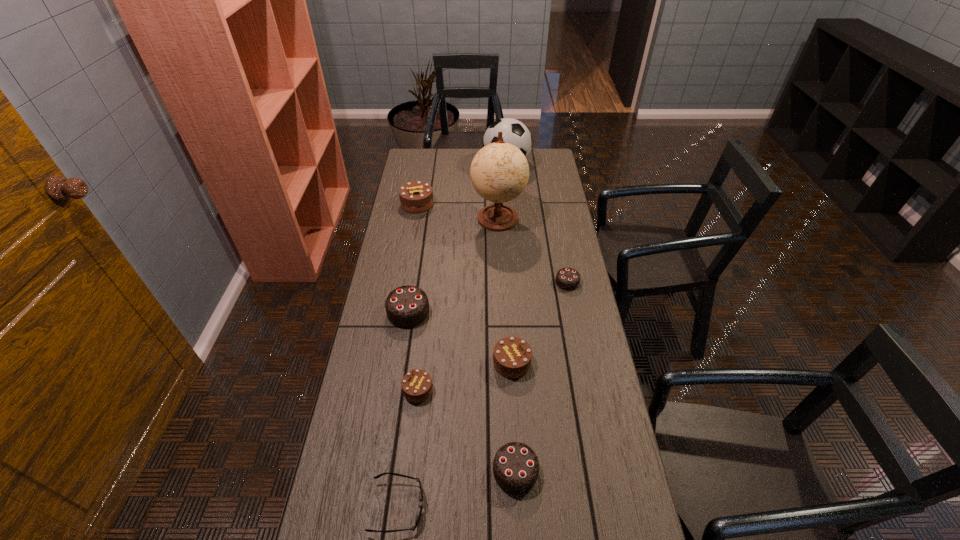
In the image, there is a desktop. What are the coordinates of `free space at the far edge` in the screenshot? It's located at (457, 164).

Identify the location of vacant space at the left edge. (373, 308).

The width and height of the screenshot is (960, 540). I want to click on vacant region at the right edge, so click(577, 472).

Locate an element on the screen. The width and height of the screenshot is (960, 540). free space at the far left corner is located at coordinates (420, 170).

Identify the location of vacant space at the far right corner. Image resolution: width=960 pixels, height=540 pixels. (555, 163).

Find the location of `blank region between the smallest chocolate chocolate cake and the soccer ball`. blank region between the smallest chocolate chocolate cake and the soccer ball is located at coordinates (537, 224).

Image resolution: width=960 pixels, height=540 pixels. In order to click on vacant space that's between the globe and the rightmost brown chocolate cake in this screenshot , I will do `click(505, 291)`.

Where is `free area in between the nearest chocolate cake and the farthest chocolate chocolate cake`? This screenshot has width=960, height=540. free area in between the nearest chocolate cake and the farthest chocolate chocolate cake is located at coordinates (541, 377).

At what (x,y) coordinates should I click in order to perform the action: click on free area in between the sunglasses and the leftmost chocolate chocolate cake. Please return your answer as a coordinate pair (x, y). Looking at the image, I should click on (403, 409).

Image resolution: width=960 pixels, height=540 pixels. I want to click on free space between the fourth farthest object and the tallest object, so click(533, 250).